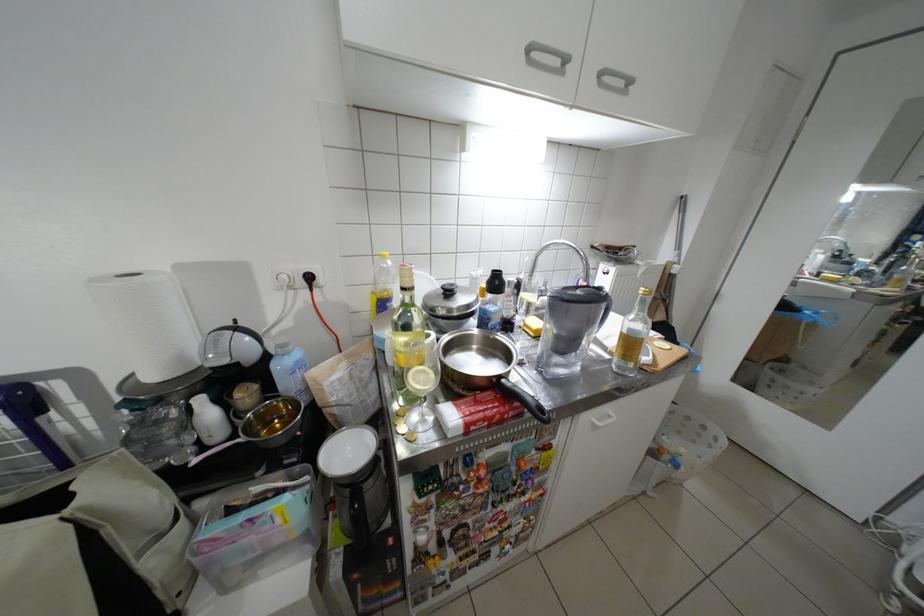
Find the location of a particular element. Image resolution: width=924 pixels, height=616 pixels. faucet handle is located at coordinates (538, 291).